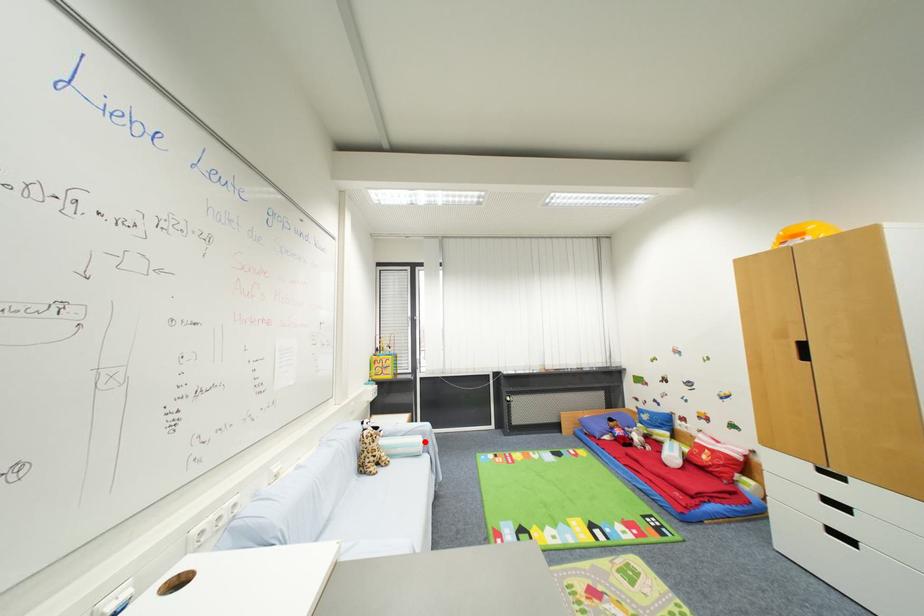
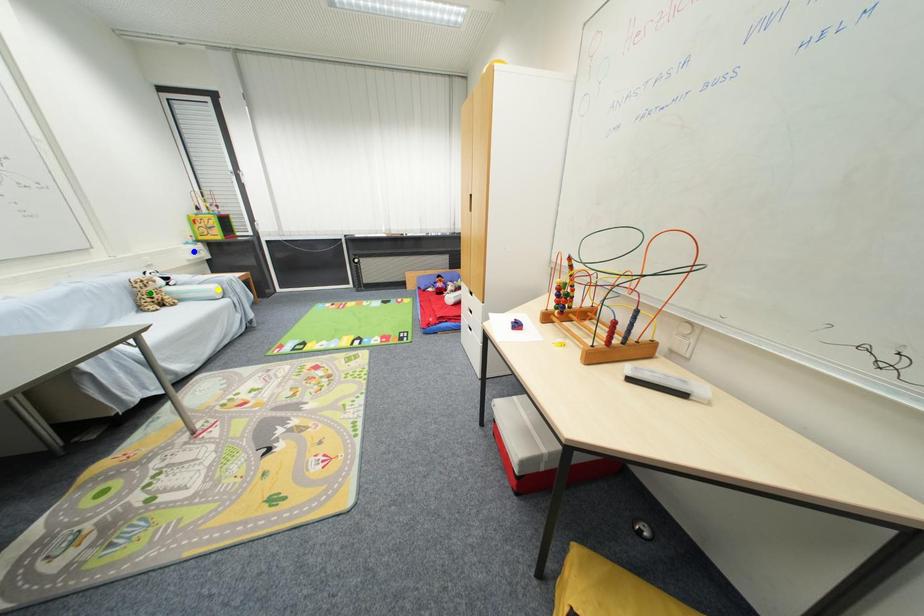
Question: I am providing you with two images of the same scene from different viewpoints. A red point is marked on the first image. You are given multiple points on the second image. Which point in image 2 is actually the same real-world point as the red point in image 1?

Choices:
 (A) blue point
 (B) green point
 (C) yellow point

Answer: (C)